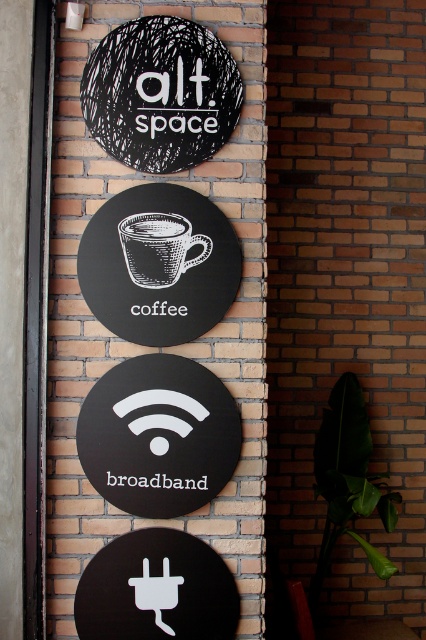
You are standing in front of a brick wall with two items at the center. You want to pick up the white textured coffee cup at center without touching the black matte sign at center. Is this possible?

The black matte sign at center is in front of the white textured coffee cup at center, so you cannot reach the white textured coffee cup at center without moving the black matte sign at center first.

You are standing in front of the brick wall with the four circular signs. You notice two points marked on the wall at coordinates point (244, 52) and point (124, 227). Which point is closer to you?

Point (244, 52) is further to the viewer than point (124, 227), so the point closer to you is point (124, 227).

You are standing at the camera position looking at the brick wall with the four circular signs. There is a point marked at coordinates (241, 1) on the wall. If you want to touch this point with a stick that is 2 meters long, will you be able to reach it?

The point at coordinates (241, 1) is 2.39 meters away from the camera. Since the stick is only 2 meters long, it is not long enough to reach the point. You will not be able to touch it with the stick.